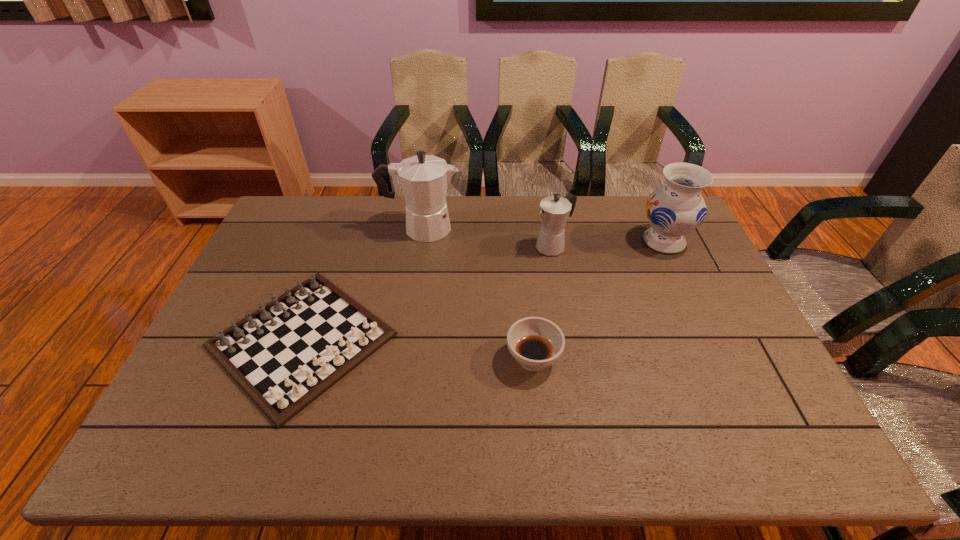
Find the location of a particular element. This screenshot has height=540, width=960. vacant point located 0.300m on the back of the chessboard is located at coordinates point(347,218).

Locate an element on the screen. coffeepot that is at the far edge is located at coordinates coord(424,179).

At what (x,y) coordinates should I click in order to perform the action: click on vase at the far edge. Please return your answer as a coordinate pair (x, y). This screenshot has height=540, width=960. Looking at the image, I should click on (677, 208).

Identify the location of object at the near edge. This screenshot has height=540, width=960. (285, 355).

I want to click on object positioned at the left edge, so coord(285,355).

Locate an element on the screen. The width and height of the screenshot is (960, 540). object that is at the right edge is located at coordinates (677, 208).

Locate an element on the screen. This screenshot has width=960, height=540. object present at the near left corner is located at coordinates (285, 355).

Where is `object present at the far right corner`? object present at the far right corner is located at coordinates (677, 208).

Where is `free space at the far edge`? The width and height of the screenshot is (960, 540). free space at the far edge is located at coordinates (499, 217).

This screenshot has width=960, height=540. I want to click on vacant space at the near edge of the desktop, so click(666, 450).